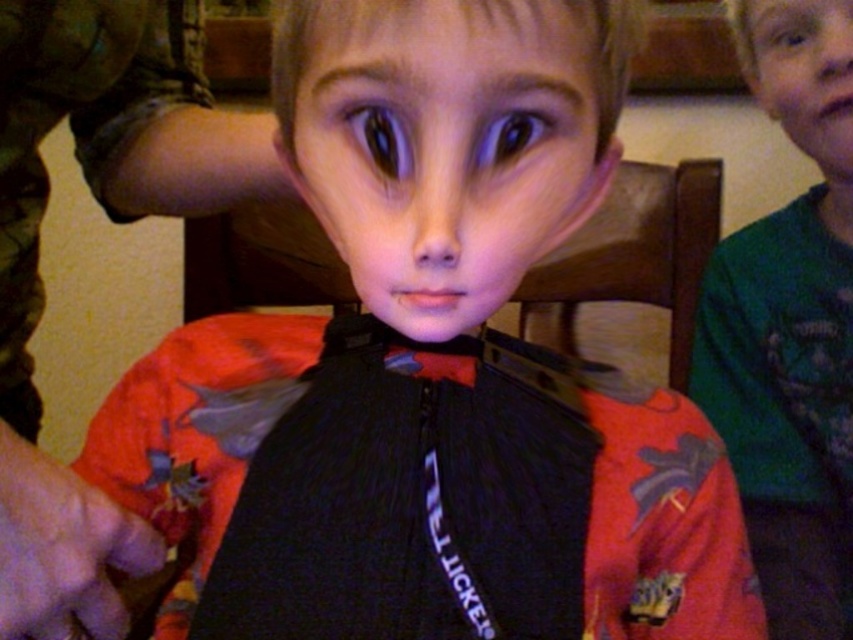
Does point (225, 193) come closer to viewer compared to point (787, 115)?

Yes, it is in front of point (787, 115).

Is point (78, 573) behind point (834, 52)?

That is False.

Locate an element on the screen. This screenshot has width=853, height=640. matte black strap at center is located at coordinates (113, 220).

Between point (548, 67) and point (28, 605), which one is positioned in front?

Point (548, 67) is more forward.

Which of these two, smooth skin face at center or matte black strap at center, stands shorter?

smooth skin face at center is shorter.

Does point (569, 134) lie in front of point (146, 45)?

Yes, it is in front of point (146, 45).

The height and width of the screenshot is (640, 853). What are the coordinates of `smooth skin face at center` in the screenshot? It's located at (445, 148).

Does matte black strap at center have a lesser width compared to smooth green shirt at upper right?

Incorrect, matte black strap at center's width is not less than smooth green shirt at upper right's.

Is matte black strap at center shorter than smooth green shirt at upper right?

No.

Between point (181, 188) and point (788, 100), which one is positioned behind?

Positioned behind is point (788, 100).

What are the coordinates of `matte black strap at center` in the screenshot? It's located at (113, 220).